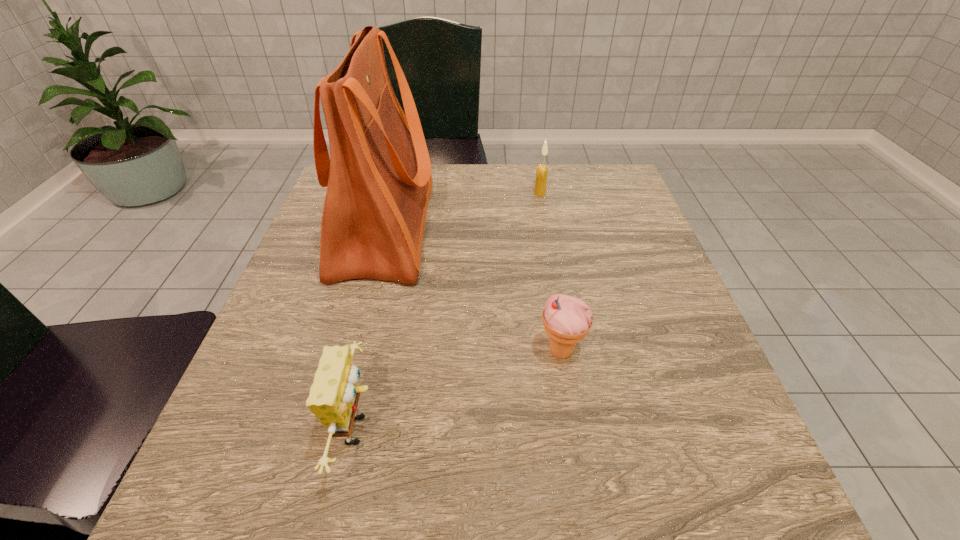
The height and width of the screenshot is (540, 960). What are the coordinates of `free space between the nearest object and the icecream` in the screenshot? It's located at (460, 391).

I want to click on free space between the nearest object and the shopping bag, so click(372, 329).

Where is `free space between the icecream and the nearest object`? The image size is (960, 540). free space between the icecream and the nearest object is located at coordinates (460, 391).

Where is `free space between the nearest object and the candle`? This screenshot has width=960, height=540. free space between the nearest object and the candle is located at coordinates (449, 312).

The height and width of the screenshot is (540, 960). What are the coordinates of `free spot between the candle and the nearest object` in the screenshot? It's located at click(x=449, y=312).

Where is `free space between the candle and the sponge`? free space between the candle and the sponge is located at coordinates click(449, 312).

This screenshot has width=960, height=540. In order to click on vacant area between the sponge and the candle in this screenshot , I will do `click(449, 312)`.

Find the location of a particular element. Image resolution: width=960 pixels, height=540 pixels. vacant region between the candle and the tallest object is located at coordinates click(463, 211).

Locate an element on the screen. vacant area that lies between the sponge and the candle is located at coordinates (449, 312).

The width and height of the screenshot is (960, 540). Find the location of `empty location between the sponge and the shopping bag`. empty location between the sponge and the shopping bag is located at coordinates (372, 329).